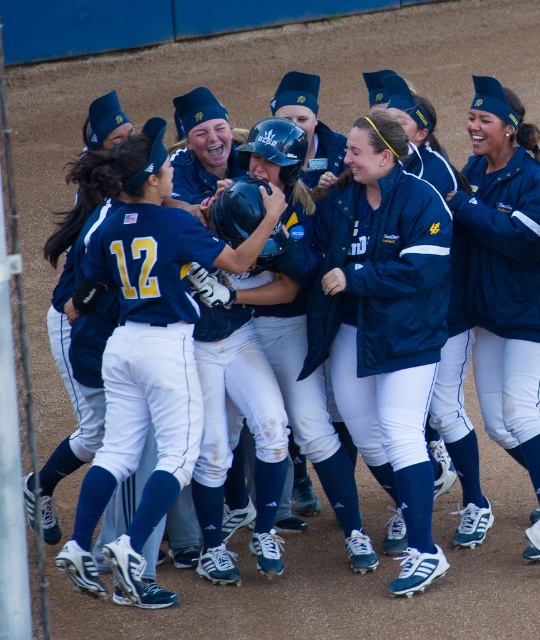
Question: Which point appears closest to the camera in this image?

Choices:
 (A) (341, 205)
 (B) (153, 356)
 (C) (491, 384)

Answer: (B)

Question: Observing the image, what is the correct spatial positioning of navy blue jersey at center in reference to matte blue jacket at center?

Choices:
 (A) below
 (B) above

Answer: (A)

Question: Which of the following is the closest to the observer?

Choices:
 (A) blue matte jacket at center
 (B) navy blue jersey at center
 (C) matte blue jacket at center

Answer: (B)

Question: Which of the following is the closest to the observer?

Choices:
 (A) blue matte jacket at center
 (B) navy blue jersey at center
 (C) matte blue jacket at center

Answer: (B)

Question: Can you confirm if blue matte jacket at center is positioned to the right of matte blue jacket at center?

Choices:
 (A) no
 (B) yes

Answer: (A)

Question: Can you confirm if blue matte jacket at center is positioned to the left of navy blue jersey at center?

Choices:
 (A) yes
 (B) no

Answer: (B)